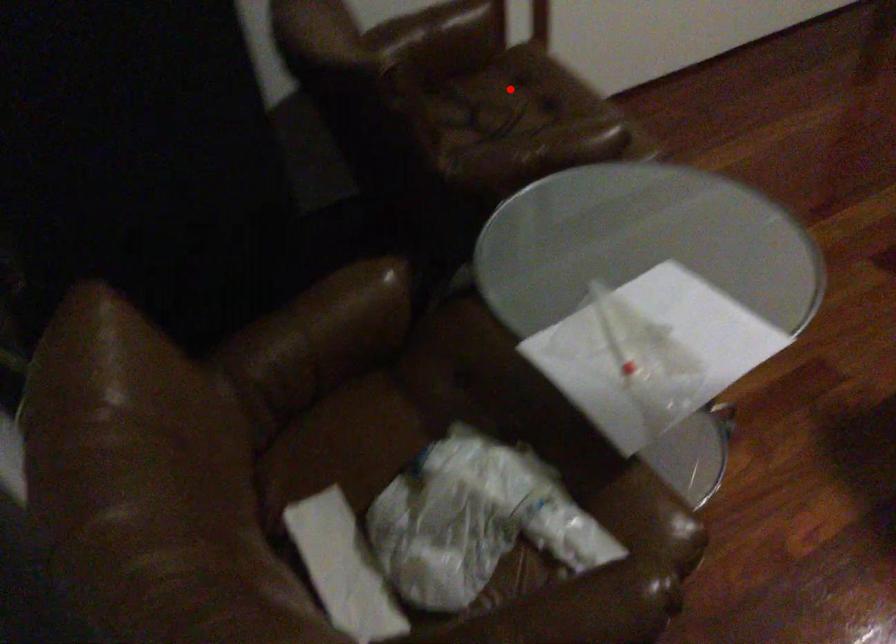
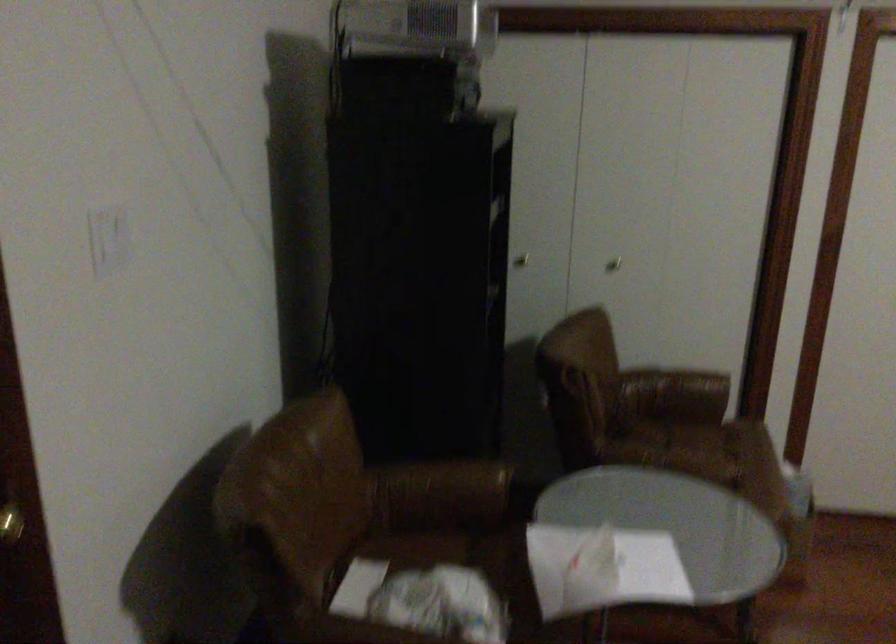
Question: I am providing you with two images of the same scene from different viewpoints. A red point is marked on the first image. Is the red point's position out of view in image 2?

Choices:
 (A) Yes
 (B) No

Answer: (B)